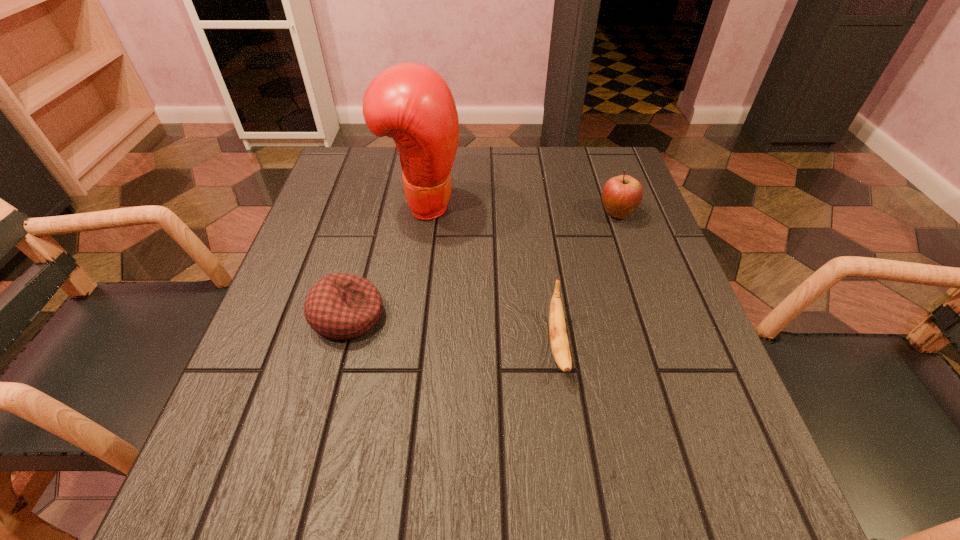
The image size is (960, 540). Identify the location of free spot between the beanbag and the tallest object. (x=385, y=260).

This screenshot has height=540, width=960. I want to click on blank region between the tallest object and the banana, so click(490, 274).

The width and height of the screenshot is (960, 540). Identify the location of free space between the tallest object and the beanbag. (385, 260).

This screenshot has height=540, width=960. Find the location of `unoccupied area between the rightmost object and the boxing glove`. unoccupied area between the rightmost object and the boxing glove is located at coordinates (519, 209).

Locate an element on the screen. The height and width of the screenshot is (540, 960). blank region between the boxing glove and the second object from right to left is located at coordinates (490, 274).

The image size is (960, 540). What are the coordinates of `vacant space in between the second object from right to left and the third shortest object` in the screenshot? It's located at (588, 279).

Where is `free space between the boxing glove and the beanbag`? free space between the boxing glove and the beanbag is located at coordinates (385, 260).

Identify the location of free spot between the apple and the beanbag. (483, 265).

Find the location of a particular element. This screenshot has height=540, width=960. free spot between the beanbag and the rightmost object is located at coordinates (483, 265).

Choose which object is the second nearest neighbor to the rightmost object. Please provide its 2D coordinates. Your answer should be formatted as a tuple, i.e. [(x, y)], where the tuple contains the x and y coordinates of a point satisfying the conditions above.

[(410, 102)]